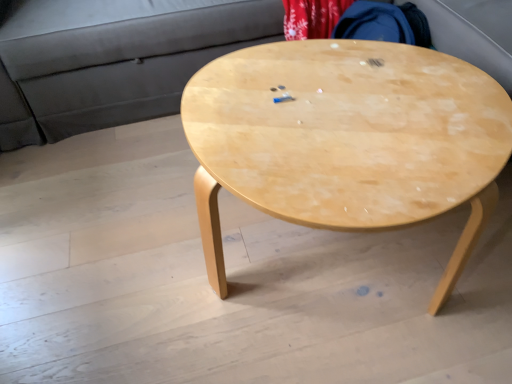
Identify the location of vacant space to the left of light wood/texture coffee table at center. (122, 241).